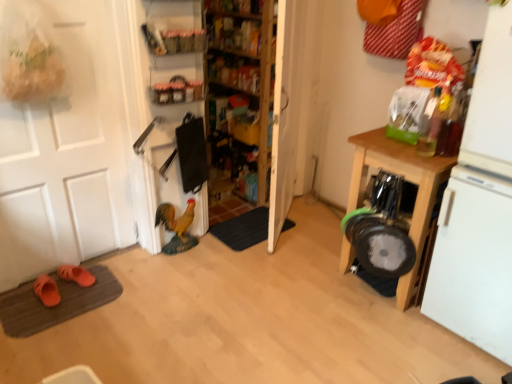
Find the location of a particular element. vacant space in front of wooden cutting board at right is located at coordinates click(x=390, y=342).